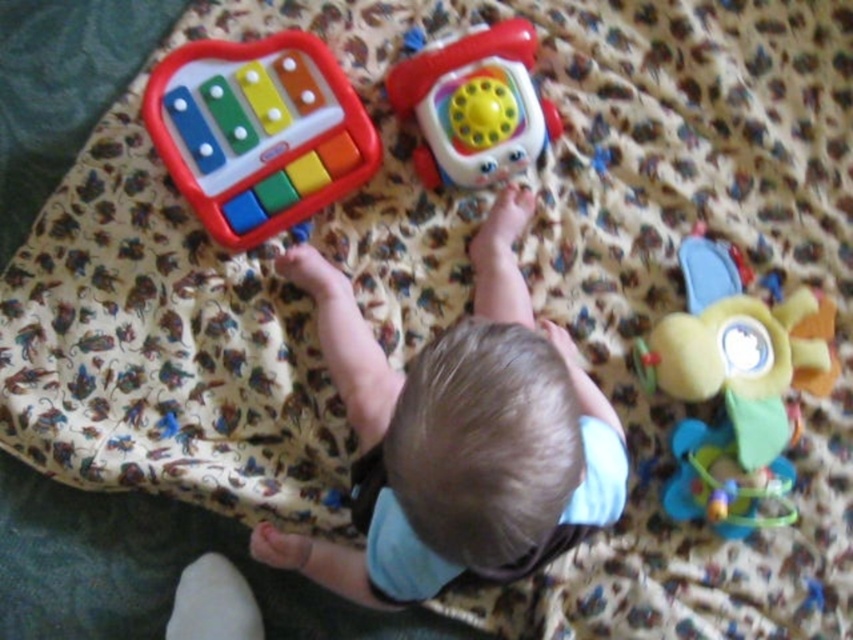
Question: Which point is farther from the camera taking this photo?

Choices:
 (A) (167, 166)
 (B) (403, 388)
 (C) (741, 484)
 (D) (463, 173)

Answer: (D)

Question: Is plastic xylophone at upper left positioned behind rubberized plastic phone at upper center?

Choices:
 (A) no
 (B) yes

Answer: (A)

Question: Which of the following is the farthest from the observer?

Choices:
 (A) (283, 67)
 (B) (456, 86)
 (C) (756, 458)

Answer: (B)

Question: Considering the relative positions of plastic xylophone at upper left and soft plush flower at upper center in the image provided, where is plastic xylophone at upper left located with respect to soft plush flower at upper center?

Choices:
 (A) above
 (B) below

Answer: (A)

Question: Which point appears farthest from the camera in this image?

Choices:
 (A) click(x=408, y=476)
 (B) click(x=538, y=129)
 (C) click(x=708, y=291)
 (D) click(x=202, y=122)

Answer: (B)

Question: Is plastic xylophone at upper left above rubberized plastic phone at upper center?

Choices:
 (A) yes
 (B) no

Answer: (B)